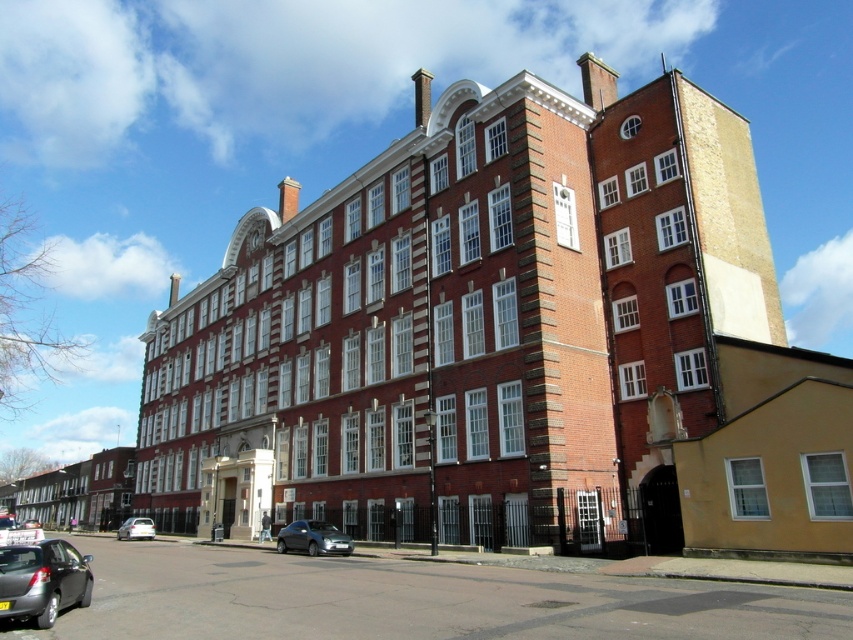
You are a delivery driver who needs to park your vehicle in the parking lot near the large brick building. You have two cars available to choose from. The matte black car at lower left and the white matte car at lower left. Which car has a smaller width and would be easier to maneuver in tight spaces?

The matte black car at lower left has a smaller width than the white matte car at lower left, so it would be easier to maneuver in tight spaces.

You are standing in front of the multi story brick building and see the satin silver car at lower center and the white matte car at lower left. Which car is nearer to you?

The satin silver car at lower center is closer to the viewer than the white matte car at lower left.